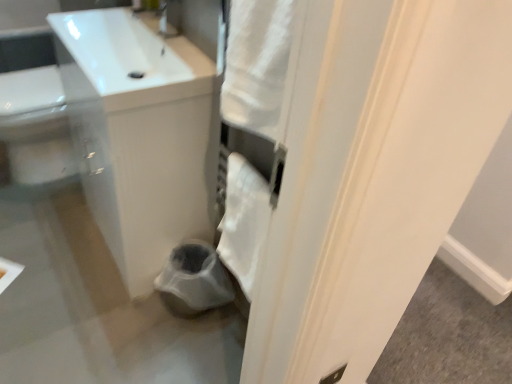
Question: In terms of height, does white soft towel at center look taller or shorter compared to white glossy sink at upper left?

Choices:
 (A) tall
 (B) short

Answer: (A)

Question: Considering the positions of white soft towel at center and white glossy sink at upper left in the image, is white soft towel at center bigger or smaller than white glossy sink at upper left?

Choices:
 (A) big
 (B) small

Answer: (B)

Question: Based on their relative distances, which object is farther from the white glossy sink at upper left?

Choices:
 (A) white soft towel at center
 (B) white glossy sink at upper left

Answer: (A)

Question: Which is nearer to the white glossy sink at upper left?

Choices:
 (A) white soft towel at center
 (B) white glossy sink at upper left

Answer: (B)